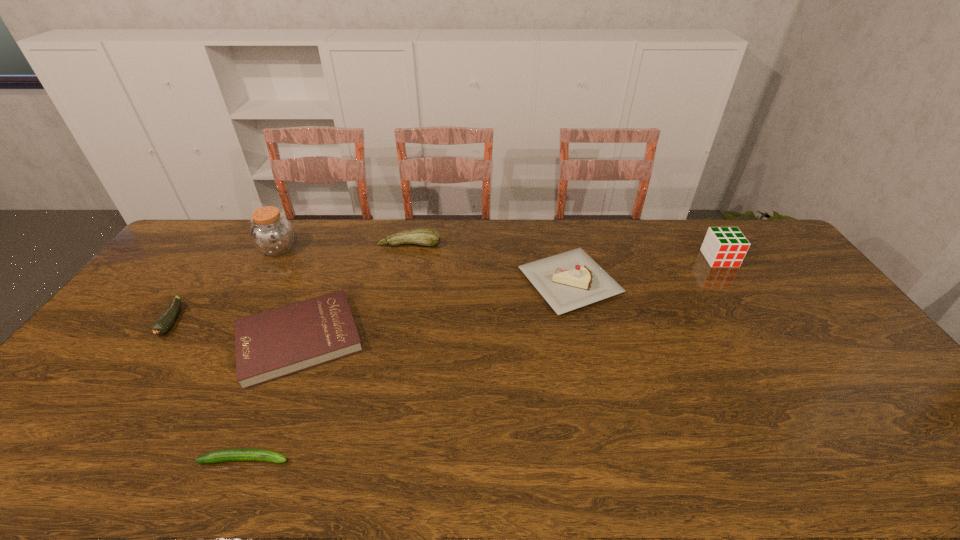
Locate an element on the screen. The width and height of the screenshot is (960, 540). object that is the sixth closest to the jar is located at coordinates (725, 246).

This screenshot has width=960, height=540. In order to click on the second closest zucchini to the hardback book in this screenshot , I will do `click(164, 323)`.

The image size is (960, 540). Find the location of `zucchini object that ranks as the closest to the hardback book`. zucchini object that ranks as the closest to the hardback book is located at coordinates (227, 455).

The image size is (960, 540). Find the location of `free point that satisfies the following two spatial constraints: 1. on the red face of the second tallest object; 2. on the front-facing side of the nearest object`. free point that satisfies the following two spatial constraints: 1. on the red face of the second tallest object; 2. on the front-facing side of the nearest object is located at coordinates (851, 460).

Locate an element on the screen. The image size is (960, 540). blank area in the image that satisfies the following two spatial constraints: 1. at the stem end of the fourth tallest object; 2. on the left side of the cake is located at coordinates (402, 282).

Where is `free space that satisfies the following two spatial constraints: 1. at the blossom end of the hardback book; 2. on the right side of the leftmost zucchini`? free space that satisfies the following two spatial constraints: 1. at the blossom end of the hardback book; 2. on the right side of the leftmost zucchini is located at coordinates (159, 339).

Identify the location of free spot that satisfies the following two spatial constraints: 1. on the front side of the tallest object; 2. on the left side of the cake. This screenshot has width=960, height=540. (259, 282).